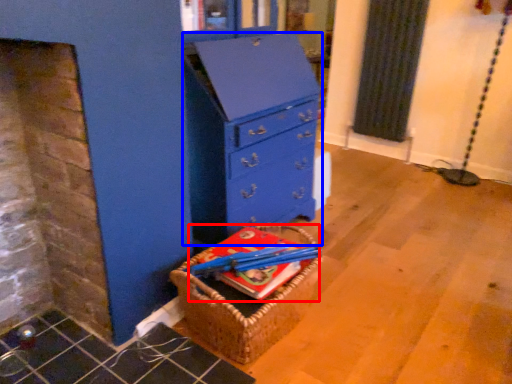
Question: Which of the following is the farthest to the observer, book (highlighted by a red box) or chest of drawers (highlighted by a blue box)?

Choices:
 (A) book
 (B) chest of drawers

Answer: (B)